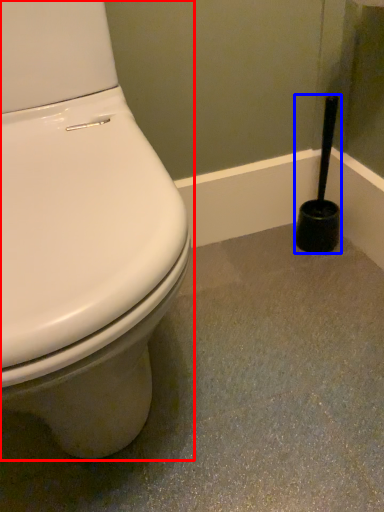
Question: Which point is closer to the camera, toilet (highlighted by a red box) or brush (highlighted by a blue box)?

Choices:
 (A) toilet
 (B) brush

Answer: (A)